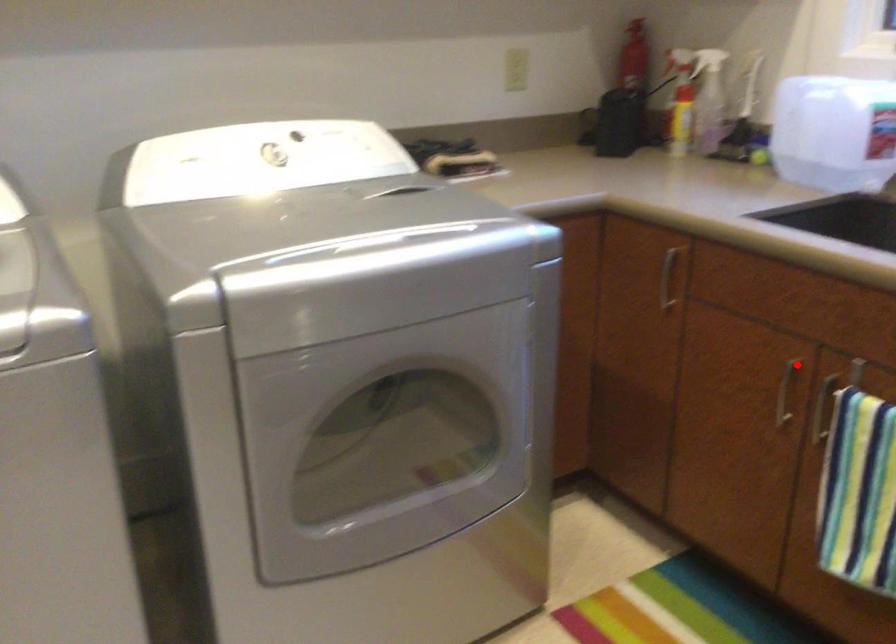
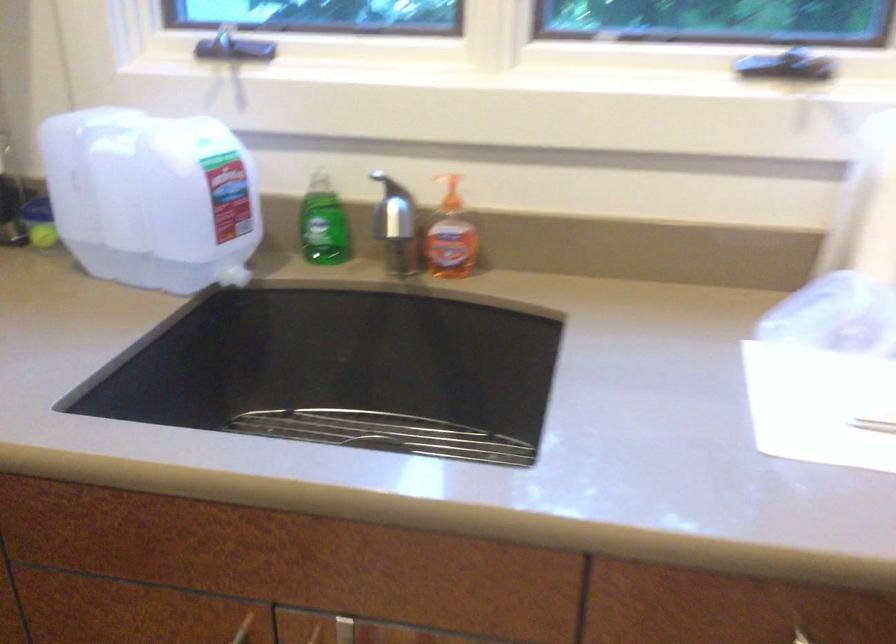
Locate, in the second image, the point that corresponds to the highlighted location in the first image.

(243, 629)